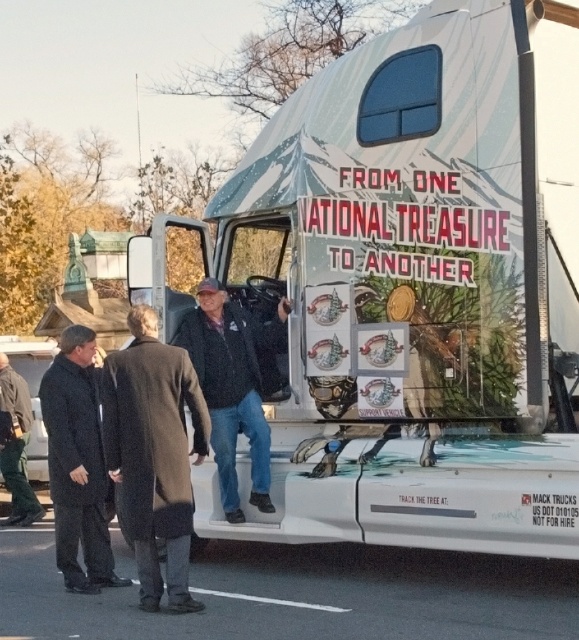
Question: Can you confirm if white matte truck at center is smaller than dark brown leather jacket at lower left?

Choices:
 (A) yes
 (B) no

Answer: (B)

Question: Which point is closer to the camera?

Choices:
 (A) (31, 502)
 (B) (339, 285)
 (C) (261, 388)
 (D) (78, 388)

Answer: (B)

Question: Which object appears closest to the camera in this image?

Choices:
 (A) knit sweater at center
 (B) black matte coat at lower left

Answer: (B)

Question: Is knit sweater at center wider than dark brown leather jacket at lower left?

Choices:
 (A) yes
 (B) no

Answer: (A)

Question: Which point is farther to the camera?

Choices:
 (A) knit sweater at center
 (B) dark gray wool coat at center

Answer: (A)

Question: Is dark gray wool coat at center to the right of knit sweater at center from the viewer's perspective?

Choices:
 (A) yes
 (B) no

Answer: (B)